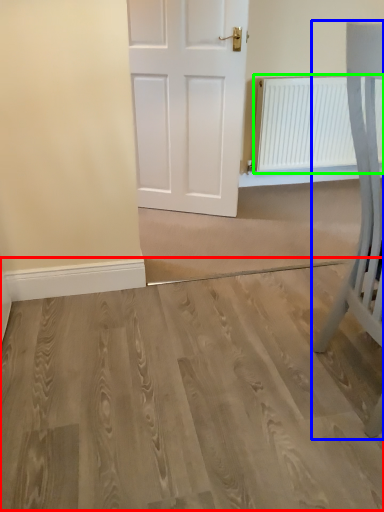
Question: Which object is positioned farthest from plain (highlighted by a red box)? Select from furniture (highlighted by a blue box) and radiator (highlighted by a green box).

Choices:
 (A) furniture
 (B) radiator

Answer: (B)